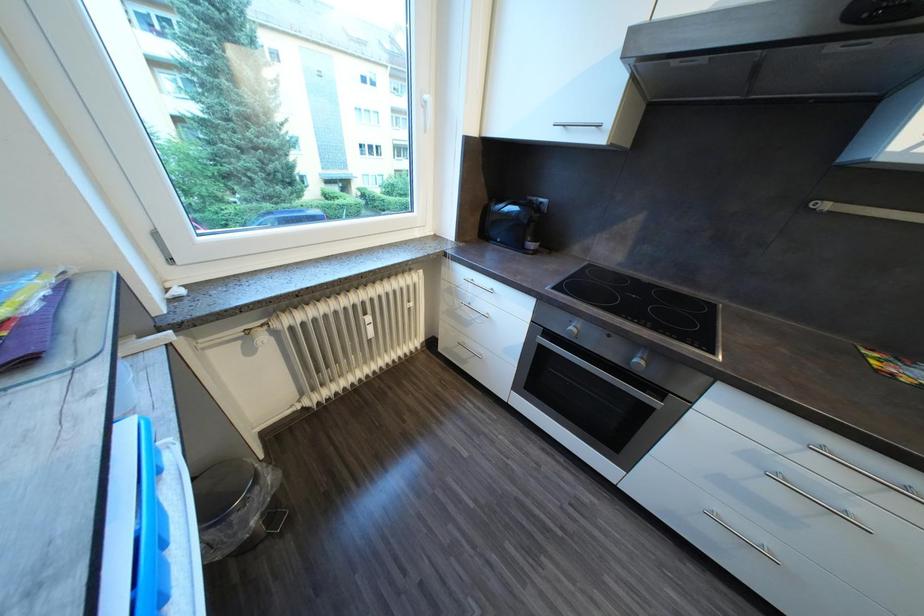
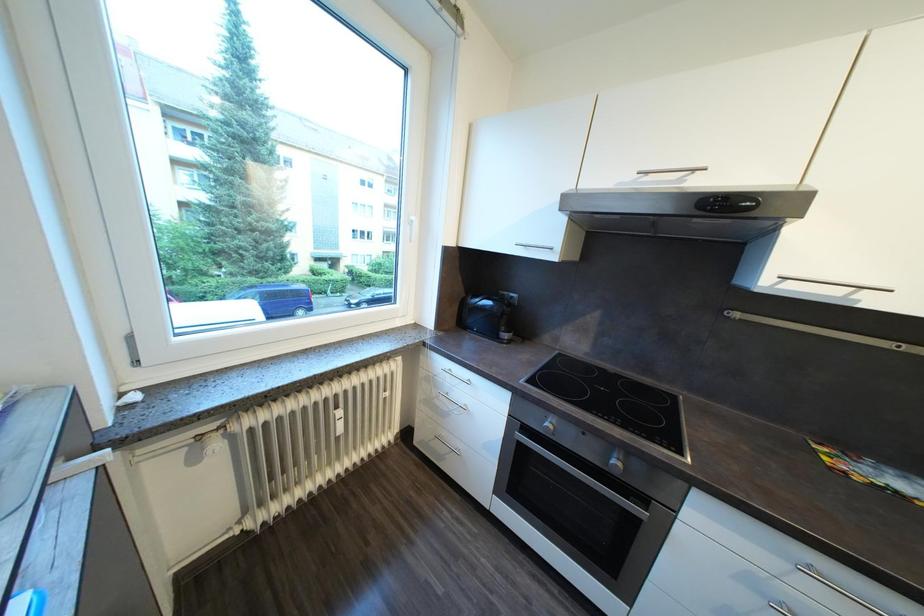
Question: How did the camera likely rotate?

Choices:
 (A) Left
 (B) Right
 (C) Up
 (D) Down

Answer: (C)